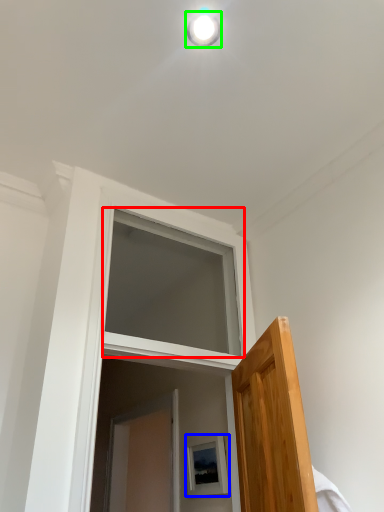
Question: Estimate the real-world distances between objects in this image. Which object is farther from window (highlighted by a red box), picture frame (highlighted by a blue box) or light fixture (highlighted by a green box)?

Choices:
 (A) picture frame
 (B) light fixture

Answer: (B)